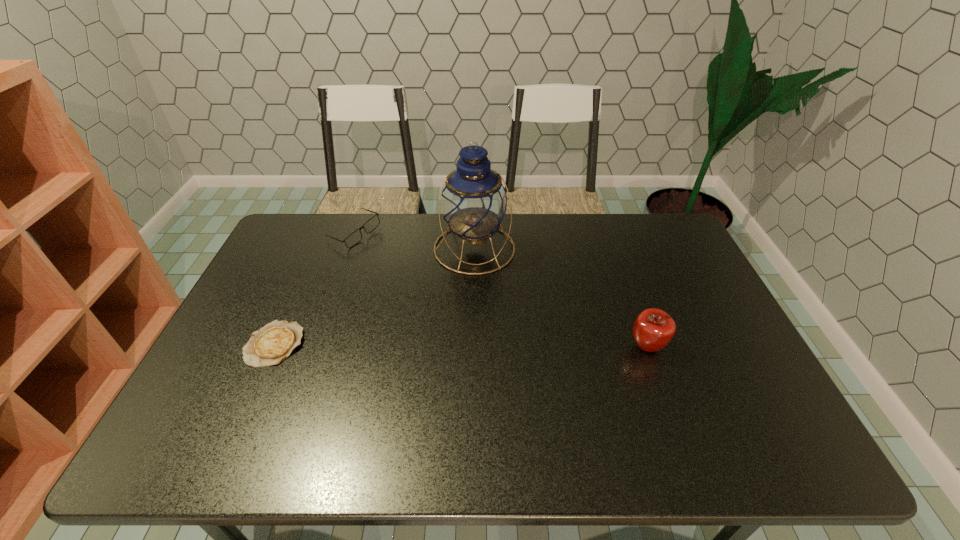
At what (x,y) coordinates should I click in order to perform the action: click on vacant space on the desktop that is between the quiche and the third shortest object and is positioned on the front-facing side of the lantern. Please return your answer as a coordinate pair (x, y). This screenshot has width=960, height=540. Looking at the image, I should click on (493, 346).

Locate an element on the screen. The width and height of the screenshot is (960, 540). vacant space on the desktop that is between the shortest object and the second tallest object and is positioned with the lenses facing outward on the third tallest object is located at coordinates (409, 345).